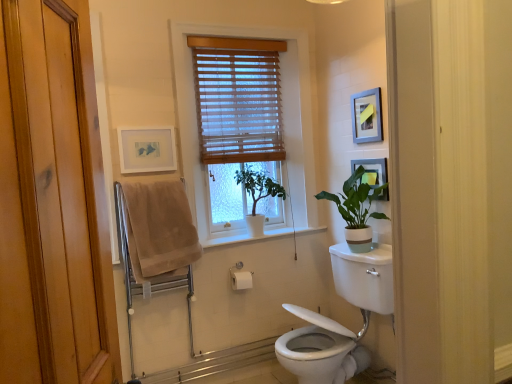
Question: Is the depth of matte black picture frame at upper right, placed as the first picture frame when sorted from right to left, less than that of white glossy toilet at lower right?

Choices:
 (A) no
 (B) yes

Answer: (A)

Question: Considering the relative sizes of matte black picture frame at upper right, which is the 3th picture frame from left to right, and white glossy toilet at lower right in the image provided, is matte black picture frame at upper right, which is the 3th picture frame from left to right, wider than white glossy toilet at lower right?

Choices:
 (A) yes
 (B) no

Answer: (B)

Question: Would you say white glossy toilet at lower right is part of matte black picture frame at upper right, placed as the first picture frame when sorted from right to left,'s contents?

Choices:
 (A) no
 (B) yes

Answer: (A)

Question: Can you confirm if matte black picture frame at upper right, placed as the first picture frame when sorted from right to left, is bigger than white glossy toilet at lower right?

Choices:
 (A) no
 (B) yes

Answer: (A)

Question: Is matte black picture frame at upper right, placed as the first picture frame when sorted from right to left, placed right next to white glossy toilet at lower right?

Choices:
 (A) no
 (B) yes

Answer: (A)

Question: Is matte black picture frame at upper right, which is the 3th picture frame from left to right, turned away from white glossy toilet at lower right?

Choices:
 (A) no
 (B) yes

Answer: (A)

Question: Considering the relative positions of silver metallic picture frame at upper right, positioned as the 2th picture frame in left-to-right order, and wooden blinds at center in the image provided, is silver metallic picture frame at upper right, positioned as the 2th picture frame in left-to-right order, to the right of wooden blinds at center from the viewer's perspective?

Choices:
 (A) no
 (B) yes

Answer: (B)

Question: Is silver metallic picture frame at upper right, the 2th picture frame viewed from the right, positioned far away from wooden blinds at center?

Choices:
 (A) yes
 (B) no

Answer: (B)

Question: Is the position of silver metallic picture frame at upper right, the 2th picture frame viewed from the right, more distant than that of wooden blinds at center?

Choices:
 (A) yes
 (B) no

Answer: (B)

Question: From the image's perspective, is silver metallic picture frame at upper right, the 2th picture frame viewed from the right, under wooden blinds at center?

Choices:
 (A) yes
 (B) no

Answer: (B)

Question: Considering the relative sizes of silver metallic picture frame at upper right, the 2th picture frame viewed from the right, and wooden blinds at center in the image provided, is silver metallic picture frame at upper right, the 2th picture frame viewed from the right, smaller than wooden blinds at center?

Choices:
 (A) no
 (B) yes

Answer: (B)

Question: Can you see silver metallic picture frame at upper right, positioned as the 2th picture frame in left-to-right order, touching wooden blinds at center?

Choices:
 (A) no
 (B) yes

Answer: (A)

Question: From the image's perspective, is matte black picture frame at upper right, placed as the first picture frame when sorted from right to left, on wooden blinds at center?

Choices:
 (A) yes
 (B) no

Answer: (B)